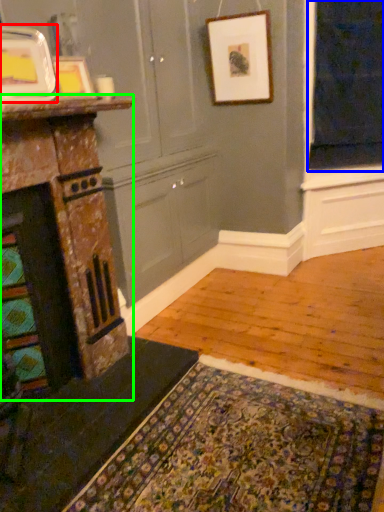
Question: Based on their relative distances, which object is nearer to picture frame (highlighted by a red box)? Choose from window screen (highlighted by a blue box) and fireplace (highlighted by a green box).

Choices:
 (A) window screen
 (B) fireplace

Answer: (B)